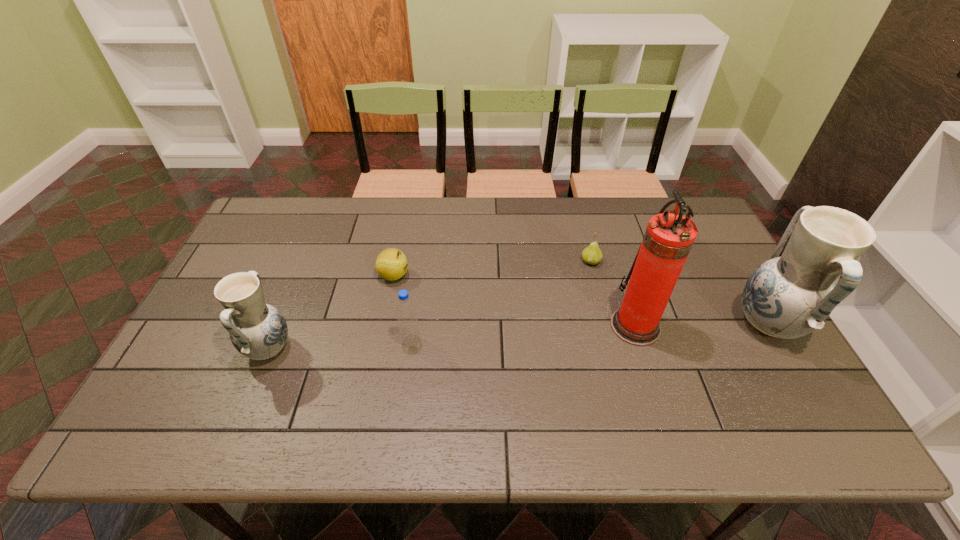
Locate an element on the screen. object located at the right edge is located at coordinates (792, 294).

I want to click on object that is positioned at the near left corner, so click(x=257, y=330).

The width and height of the screenshot is (960, 540). In order to click on vacant space at the far edge of the desktop in this screenshot , I will do `click(503, 227)`.

At what (x,y) coordinates should I click in order to perform the action: click on vacant region at the near edge of the desktop. Please return your answer as a coordinate pair (x, y). The width and height of the screenshot is (960, 540). Looking at the image, I should click on (348, 401).

The image size is (960, 540). In order to click on blank space at the right edge of the desktop in this screenshot , I will do `click(731, 268)`.

Locate an element on the screen. This screenshot has height=540, width=960. free space at the far left corner of the desktop is located at coordinates (301, 219).

This screenshot has height=540, width=960. In the image, there is a desktop. Identify the location of vacant space at the near left corner. (213, 370).

Identify the location of vacant area at the far right corner. The height and width of the screenshot is (540, 960). (662, 196).

Where is `vacant space that's between the fire extinguisher and the rightmost object`? Image resolution: width=960 pixels, height=540 pixels. vacant space that's between the fire extinguisher and the rightmost object is located at coordinates (702, 326).

What are the coordinates of `free point between the fourth object from right to left and the shorter pottery` in the screenshot? It's located at (340, 345).